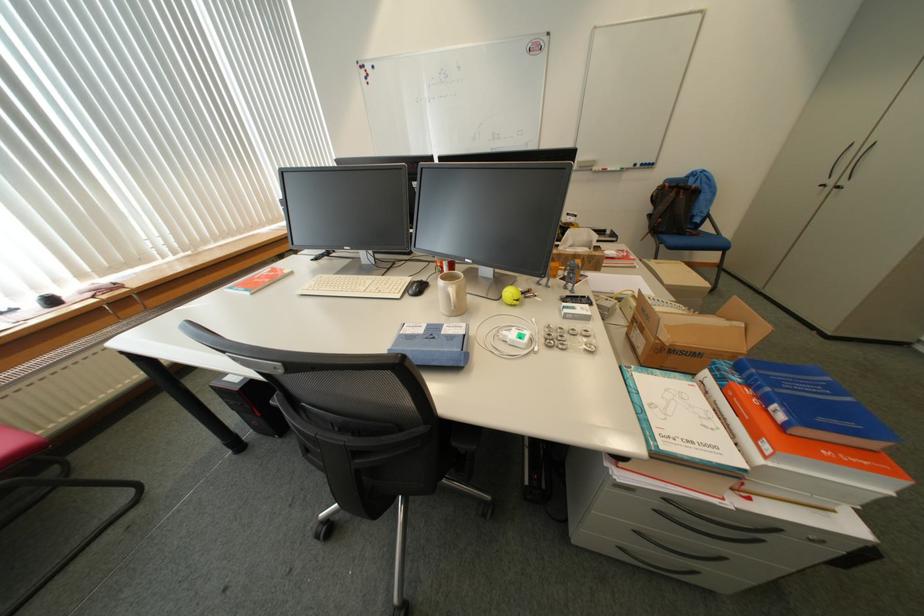
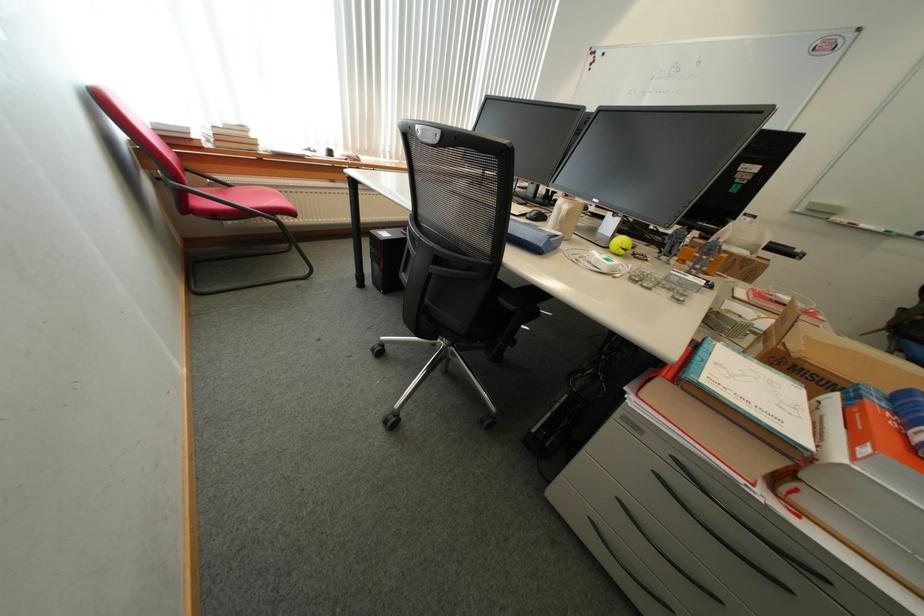
The point at (675, 326) is marked in the first image. Where is the corresponding point in the second image?

(816, 339)